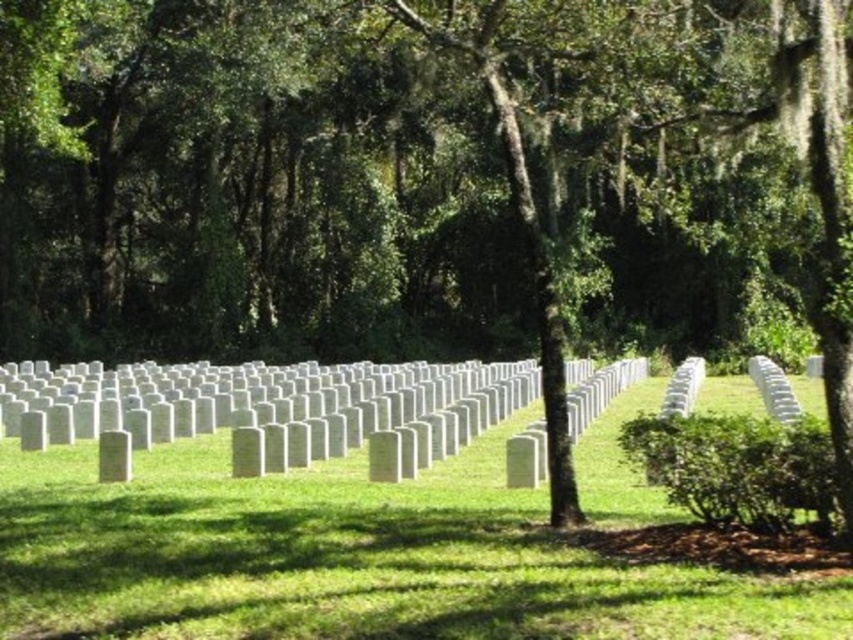
Is green grass at center bigger than white marble headstones at center?

No.

Where is `green grass at center`? The height and width of the screenshot is (640, 853). green grass at center is located at coordinates (345, 556).

Find the location of a particular element. The height and width of the screenshot is (640, 853). green grass at center is located at coordinates (345, 556).